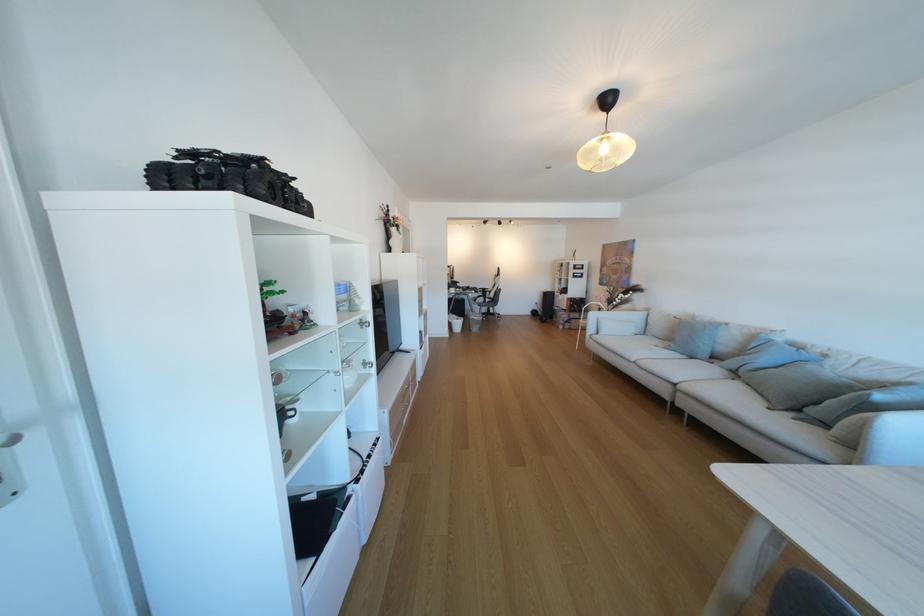
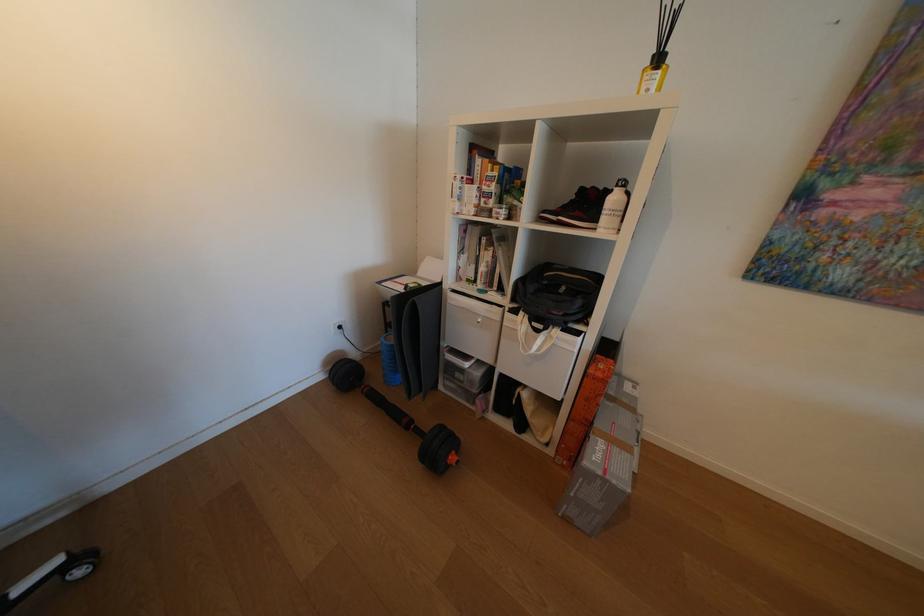
In the second image, find the point that corresponds to point (572, 294) in the first image.

(548, 331)